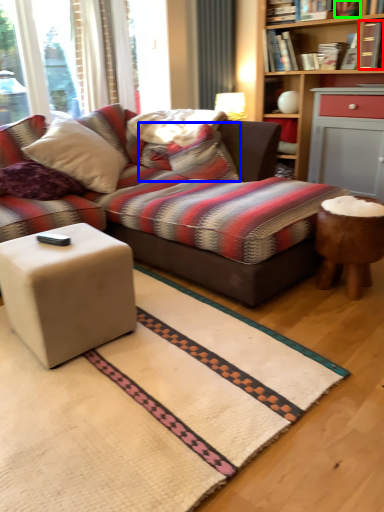
Question: Estimate the real-world distances between objects in this image. Which object is closer to book (highlighted by a red box), pillow (highlighted by a blue box) or book (highlighted by a green box)?

Choices:
 (A) pillow
 (B) book

Answer: (B)